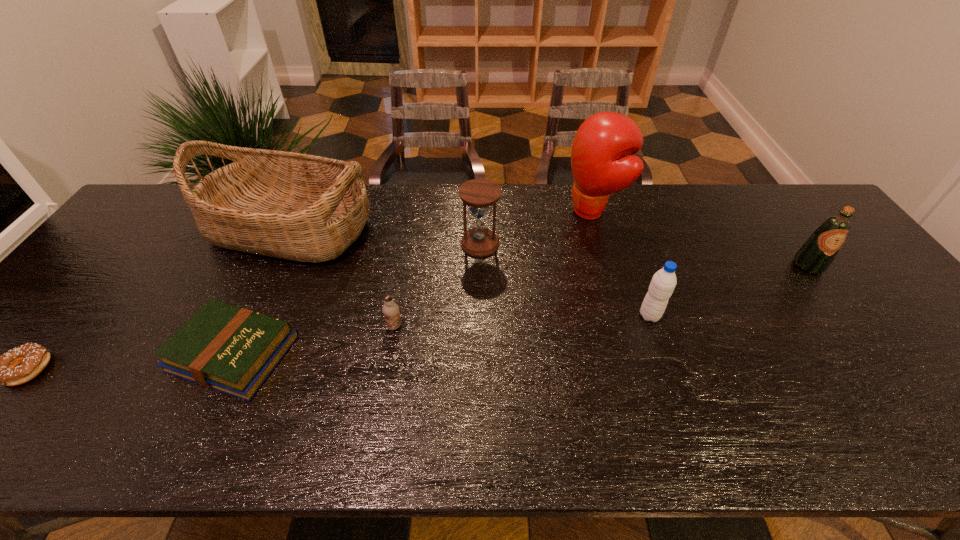
Where is `vacant space located 0.250m on the striking surface of the tallest object`? vacant space located 0.250m on the striking surface of the tallest object is located at coordinates (486, 211).

This screenshot has height=540, width=960. I want to click on free space located 0.160m on the front of the basket, so click(252, 312).

You are a GUI agent. You are given a task and a screenshot of the screen. Output one action in this format:
    pyautogui.click(x=<x>, y=<y>)
    Task: Click on the vacant position located on the front-facing side of the rightmost object
    
    Given the screenshot: What is the action you would take?
    pyautogui.click(x=864, y=341)

Where is `free space located on the left of the hourglass`? Image resolution: width=960 pixels, height=540 pixels. free space located on the left of the hourglass is located at coordinates tap(444, 244).

The height and width of the screenshot is (540, 960). Identify the location of free location located on the left of the water bottle. (576, 315).

What are the coordinates of `free space located 0.350m on the left of the fourth object from left to right` in the screenshot? It's located at (246, 326).

The height and width of the screenshot is (540, 960). What are the coordinates of `vacant space located on the back of the seventh tallest object` in the screenshot? It's located at (295, 221).

Identify the location of boxing glove present at the far edge. (598, 167).

This screenshot has width=960, height=540. Find the location of `basket that is at the far edge`. basket that is at the far edge is located at coordinates (300, 207).

I want to click on object that is at the right edge, so click(x=815, y=256).